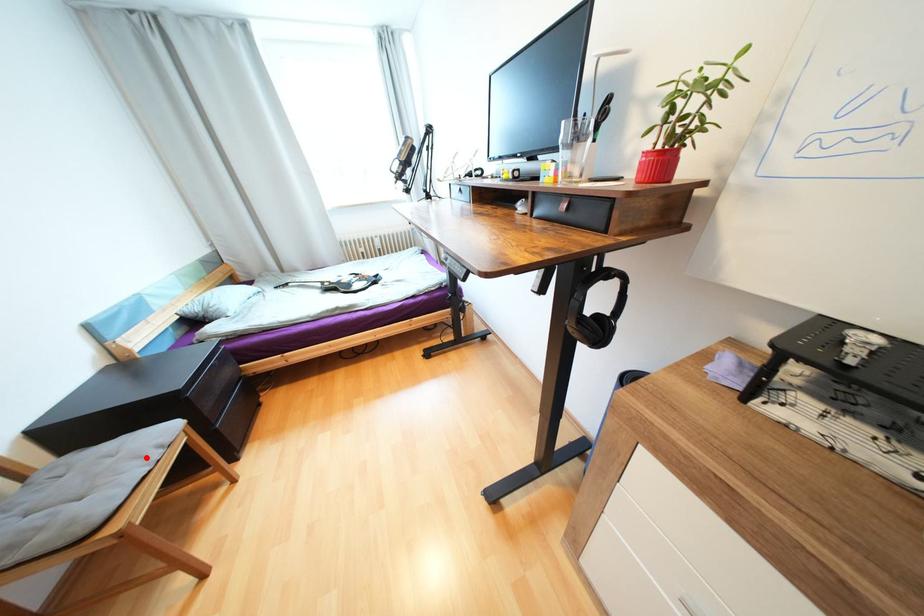
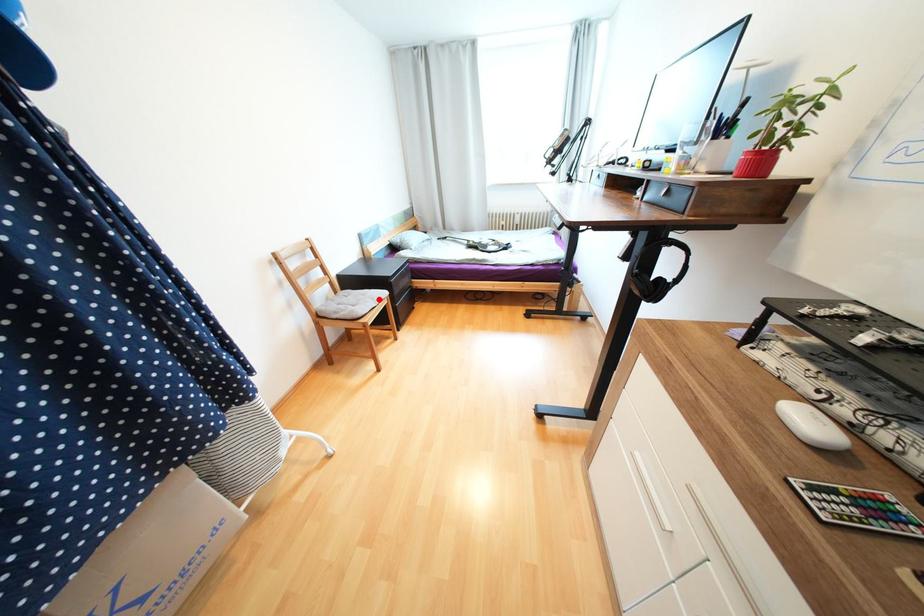
I am providing you with two images of the same scene from different viewpoints. A red point is marked on the first image and another point is marked on the second image. Do the highlighted points in image1 and image2 indicate the same real-world spot?

Yes